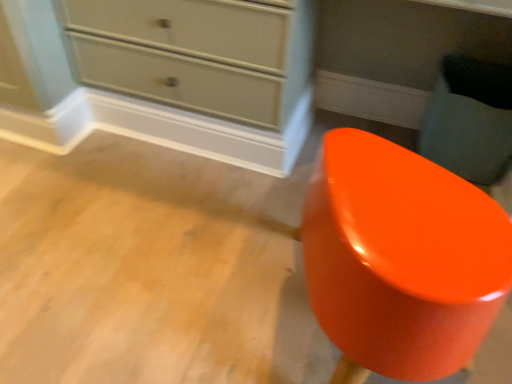
Identify the location of vacant space that is to the left of glossy orange stool at lower right. pyautogui.click(x=178, y=289).